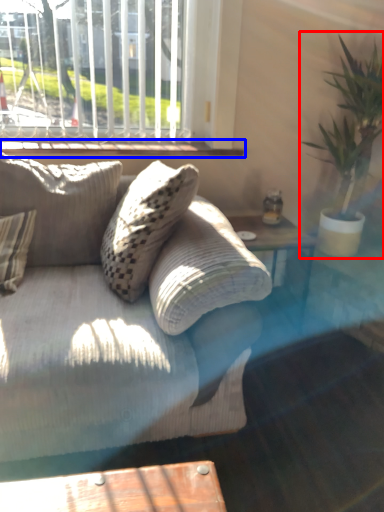
Question: Which point is further to the camera, houseplant (highlighted by a red box) or window sill (highlighted by a blue box)?

Choices:
 (A) houseplant
 (B) window sill

Answer: (B)